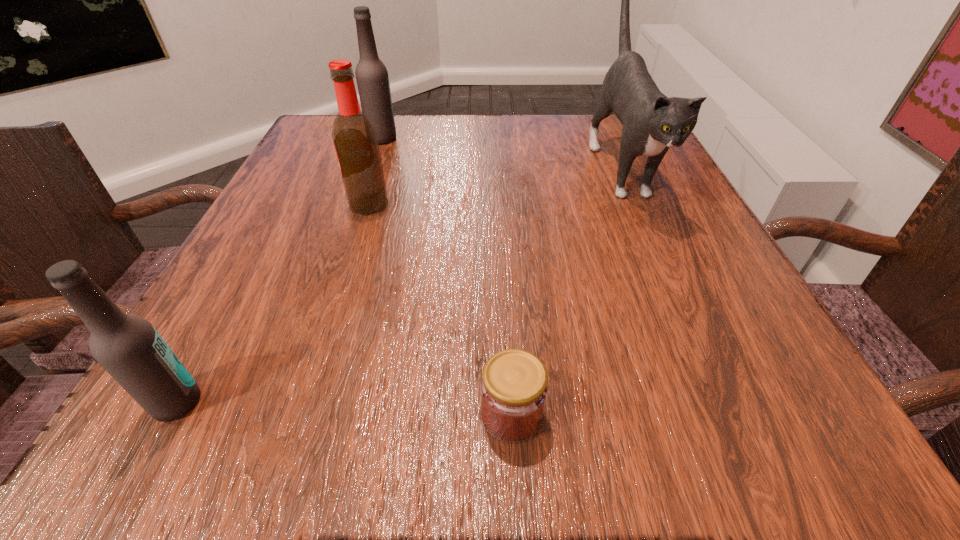
Identify the location of vacant space that satisfies the following two spatial constraints: 1. on the label of the shortest object; 2. on the left side of the leftmost object. This screenshot has height=540, width=960. (170, 414).

At what (x,y) coordinates should I click in order to perform the action: click on free space that satisfies the following two spatial constraints: 1. on the side of the farthest beer bottle with the label; 2. on the back side of the second nearest beer bottle. Please return your answer as a coordinate pair (x, y). This screenshot has width=960, height=540. Looking at the image, I should click on (359, 205).